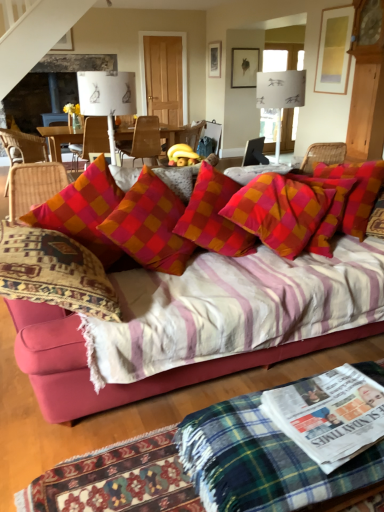
Question: Which direction should I rotate to face checkered fabric pillow at center, placed as the first pillow when sorted from left to right, — up or down?

Choices:
 (A) up
 (B) down

Answer: (A)

Question: Is checkered fabric pillow at center, placed as the first pillow when sorted from left to right, not within woven wicker chair at left, arranged as the first chair when viewed from the left?

Choices:
 (A) yes
 (B) no

Answer: (A)

Question: Can you confirm if checkered fabric pillow at center, marked as the 2th pillow in a right-to-left arrangement, is positioned to the left of woven wicker chair at left, the 4th chair positioned from the right?

Choices:
 (A) no
 (B) yes

Answer: (A)

Question: Could you tell me if checkered fabric pillow at center, placed as the first pillow when sorted from left to right, is turned towards woven wicker chair at left, arranged as the first chair when viewed from the left?

Choices:
 (A) yes
 (B) no

Answer: (B)

Question: Is checkered fabric pillow at center, placed as the first pillow when sorted from left to right, wider than woven wicker chair at left, arranged as the first chair when viewed from the left?

Choices:
 (A) no
 (B) yes

Answer: (A)

Question: Can you confirm if checkered fabric pillow at center, marked as the 2th pillow in a right-to-left arrangement, is bigger than woven wicker chair at left, the 4th chair positioned from the right?

Choices:
 (A) no
 (B) yes

Answer: (A)

Question: Can you confirm if checkered fabric pillow at center, marked as the 2th pillow in a right-to-left arrangement, is positioned to the right of woven wicker chair at left, arranged as the first chair when viewed from the left?

Choices:
 (A) no
 (B) yes

Answer: (B)

Question: Is the depth of white glossy newspaper at lower right greater than that of wooden chair at center, the 4th chair in the left-to-right sequence?

Choices:
 (A) yes
 (B) no

Answer: (B)

Question: Is white glossy newspaper at lower right not close to wooden chair at center, the 4th chair in the left-to-right sequence?

Choices:
 (A) no
 (B) yes

Answer: (B)

Question: From a real-world perspective, is white glossy newspaper at lower right physically below wooden chair at center, the 1th chair viewed from the right?

Choices:
 (A) no
 (B) yes

Answer: (B)

Question: Does white glossy newspaper at lower right contain wooden chair at center, the 1th chair viewed from the right?

Choices:
 (A) yes
 (B) no

Answer: (B)

Question: Is white glossy newspaper at lower right touching wooden chair at center, the 1th chair viewed from the right?

Choices:
 (A) no
 (B) yes

Answer: (A)

Question: Is white glossy newspaper at lower right facing towards wooden chair at center, the 4th chair in the left-to-right sequence?

Choices:
 (A) no
 (B) yes

Answer: (A)

Question: Are wooden chair at center, acting as the second chair starting from the left, and plaid fabric pillow at center, which appears as the 1th pillow when viewed from the right, making contact?

Choices:
 (A) yes
 (B) no

Answer: (B)